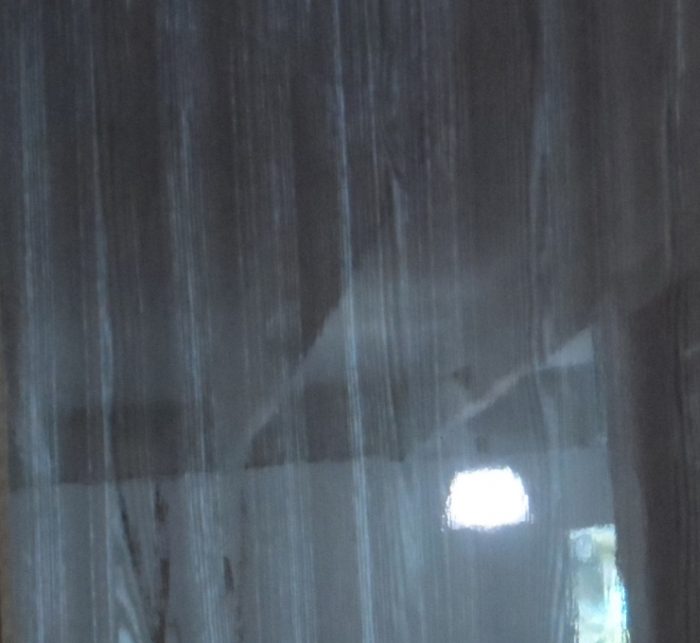
Image resolution: width=700 pixels, height=643 pixels. Find the location of `door held open and pulled back against the wall`. door held open and pulled back against the wall is located at coordinates (512, 588).